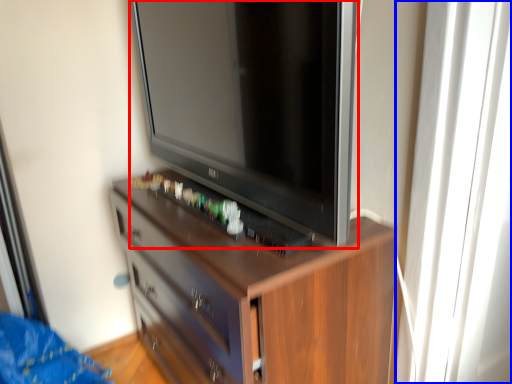
Question: Which object appears farthest to the camera in this image, television (highlighted by a red box) or glass door (highlighted by a blue box)?

Choices:
 (A) television
 (B) glass door

Answer: (B)